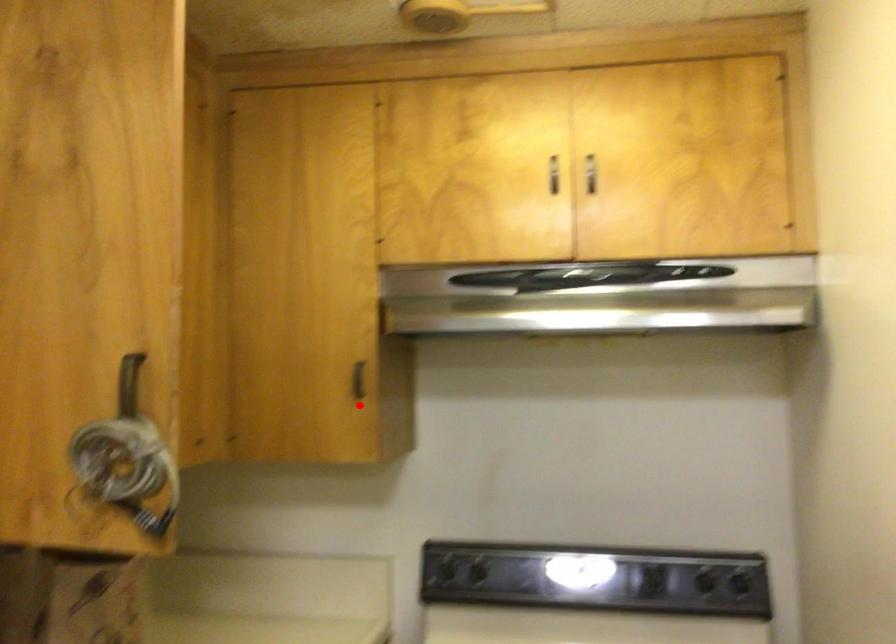
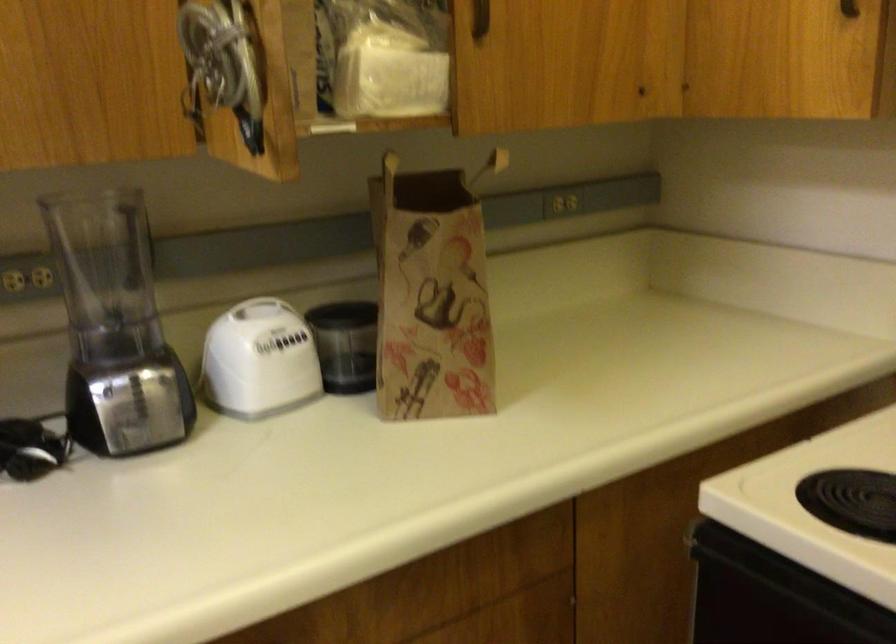
Find the pixel in the second image that matches the highlighted location in the first image.

(849, 8)